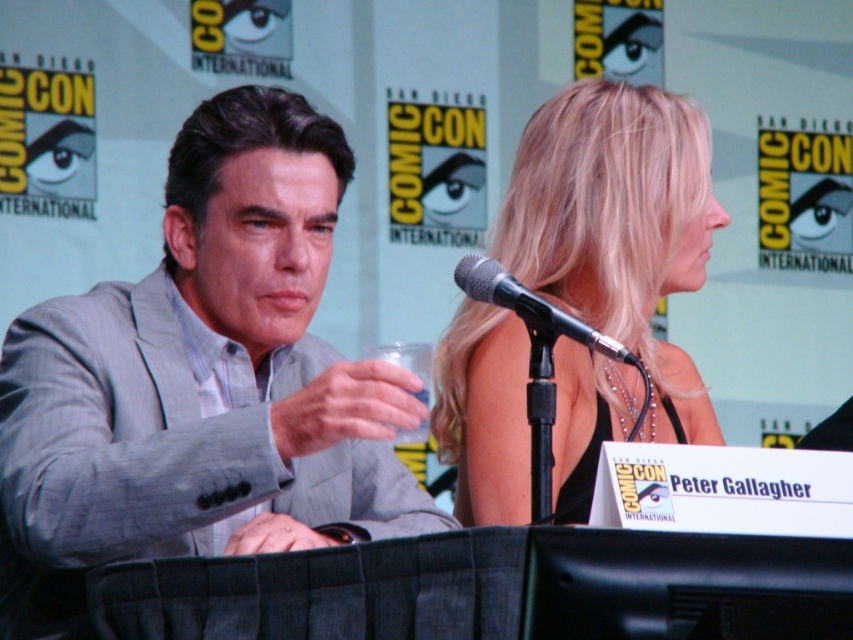
You are attending a panel discussion at Comic Con and notice two items in the front row. The gray pinstripe suit at left and the black metallic microphone at upper center. Which item is taller?

The gray pinstripe suit at left is much taller than the black metallic microphone at upper center.

You are a photographer at the event and need to capture a photo of the gray pinstripe suit at left and the black metallic microphone at upper center. Based on their positions, which object is wider?

The gray pinstripe suit at left is wider than the black metallic microphone at upper center according to the description.

You are a photographer at Comic Con and want to capture a closeup of the blonde hair at center and the black metallic microphone at upper center. Which object is wider in the frame?

The blonde hair at center is wider than the black metallic microphone at upper center according to the description.